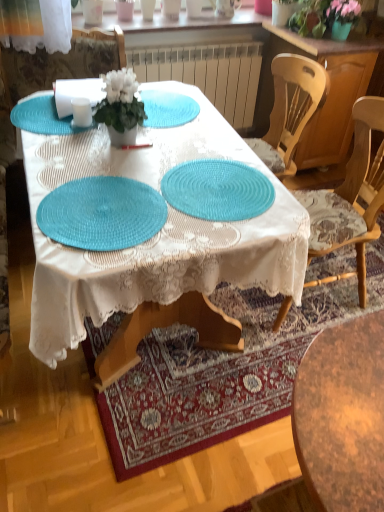
At what (x,y) coordinates should I click in order to perform the action: click on free location in front of white matte pot at center. Please return your answer as a coordinate pair (x, y). The width and height of the screenshot is (384, 512). Looking at the image, I should click on (118, 161).